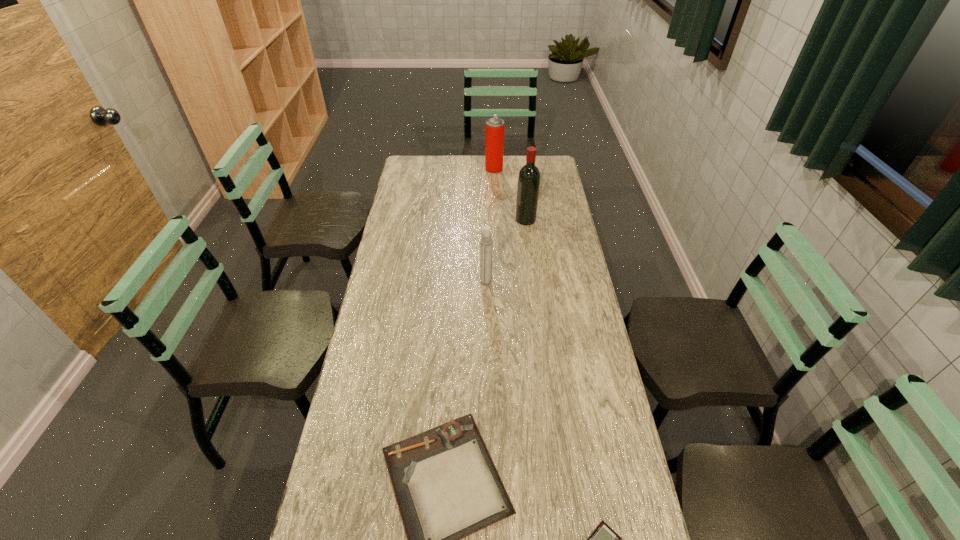
Find the location of a particular element. The width and height of the screenshot is (960, 540). object located at the right edge is located at coordinates (529, 176).

Where is `free space at the left edge of the desktop`? free space at the left edge of the desktop is located at coordinates pyautogui.click(x=353, y=369).

In the image, there is a desktop. At what (x,y) coordinates should I click in order to perform the action: click on vacant area at the right edge. Please return your answer as a coordinate pair (x, y). The width and height of the screenshot is (960, 540). Looking at the image, I should click on (544, 184).

Find the location of `vacant space at the far left corner of the desktop`. vacant space at the far left corner of the desktop is located at coordinates (425, 173).

Find the location of a particular element. The width and height of the screenshot is (960, 540). free space at the far right corner of the desktop is located at coordinates (538, 158).

The width and height of the screenshot is (960, 540). I want to click on vacant space that's between the second farthest object and the farthest object, so click(x=510, y=194).

Select which object is the third closest to the clipboard. Please provide its 2D coordinates. Your answer should be formatted as a tuple, i.e. [(x, y)], where the tuple contains the x and y coordinates of a point satisfying the conditions above.

[(529, 176)]

Identify the location of object that is the closest to the farthest object. (529, 176).